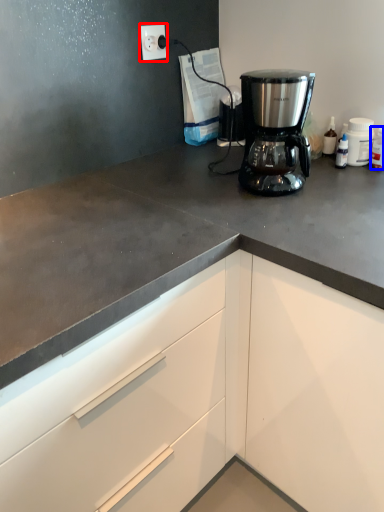
Question: Among these objects, which one is farthest to the camera, electric outlet (highlighted by a red box) or bottle (highlighted by a blue box)?

Choices:
 (A) electric outlet
 (B) bottle

Answer: (A)